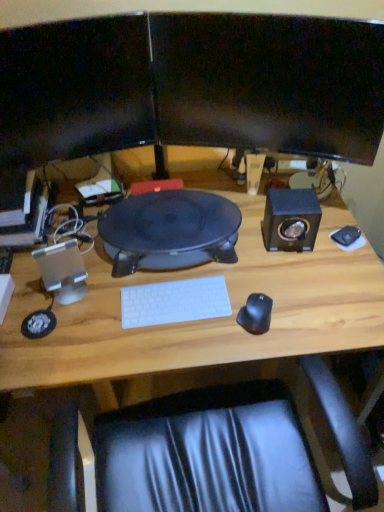
You are a GUI agent. You are given a task and a screenshot of the screen. Output one action in this format:
    pyautogui.click(x=<x>, y=<y>)
    Task: Click on the unoccupied area behind black matte mouse at right, acting as the second mouse starting from the front
    The image size is (384, 512).
    Given the screenshot: What is the action you would take?
    pyautogui.click(x=330, y=212)